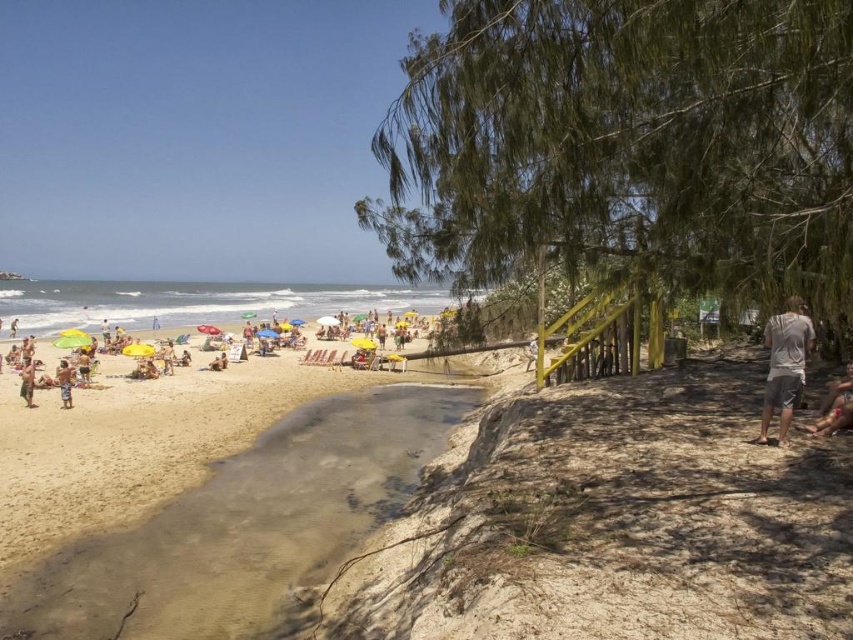
You are standing on the beach and want to walk from the yellow umbrellas at beach left to the gray cotton shirt at right. Which direction should you move relative to the umbrellas?

Since the yellow umbrellas at beach left are closer to you than the gray cotton shirt at right, you should move away from the umbrellas towards the direction of the gray cotton shirt at right.

You are standing on the beach and want to walk towards the ocean. You see the light brown sand at lower left and the brown fabric shorts at lower left. Which object is closer to you as you start walking?

The light brown sand at lower left is closer to you than the brown fabric shorts at lower left, so you will encounter the light brown sand first as you begin walking towards the ocean.

You are standing on the beach and see the light brown sand at lower left and the brown fabric shorts at lower left. Which object is positioned more to the right?

The light brown sand at lower left is positioned to the right of the brown fabric shorts at lower left.